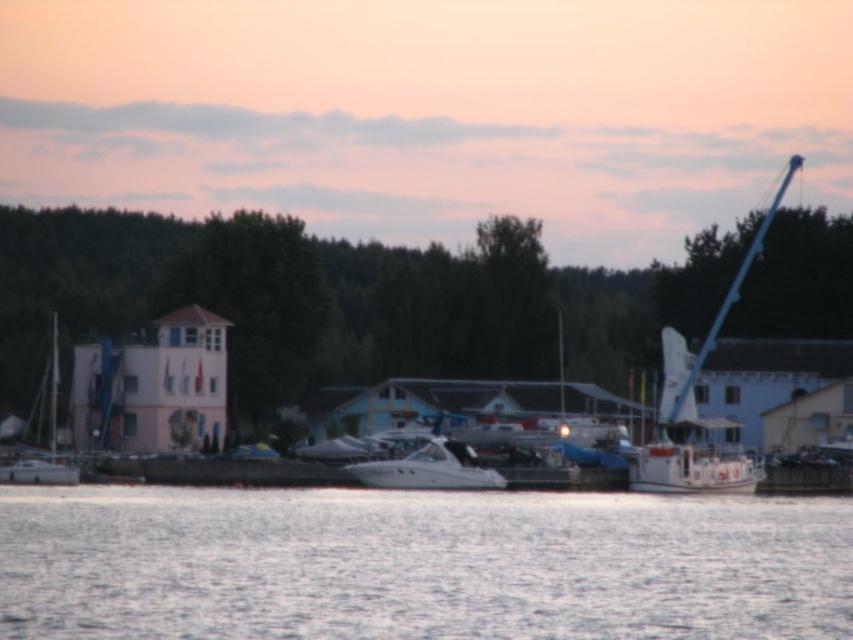
Is white matte boat at right bigger than white glossy boat at center?

Yes.

Does white matte boat at right appear on the right side of white glossy boat at center?

Yes, white matte boat at right is to the right of white glossy boat at center.

Identify the location of white matte boat at right. (694, 403).

Find the location of a particular element. This screenshot has height=640, width=853. white matte boat at right is located at coordinates (694, 403).

Does point (164, 561) lie in front of point (664, 403)?

Yes, point (164, 561) is in front of point (664, 403).

Is clear water at center to the left of white matte boat at right from the viewer's perspective?

Correct, you'll find clear water at center to the left of white matte boat at right.

Which is behind, point (219, 509) or point (741, 278)?

Point (741, 278)

You are a GUI agent. You are given a task and a screenshot of the screen. Output one action in this format:
    pyautogui.click(x=<x>, y=<y>)
    Task: Click on the clear water at center
    The width and height of the screenshot is (853, 640).
    Given the screenshot: What is the action you would take?
    pyautogui.click(x=418, y=564)

Is clear water at center taller than white glossy boat at center?

Indeed, clear water at center has a greater height compared to white glossy boat at center.

Which of these two, clear water at center or white glossy boat at center, stands shorter?

Standing shorter between the two is white glossy boat at center.

Locate an element on the screen. This screenshot has height=640, width=853. clear water at center is located at coordinates (418, 564).